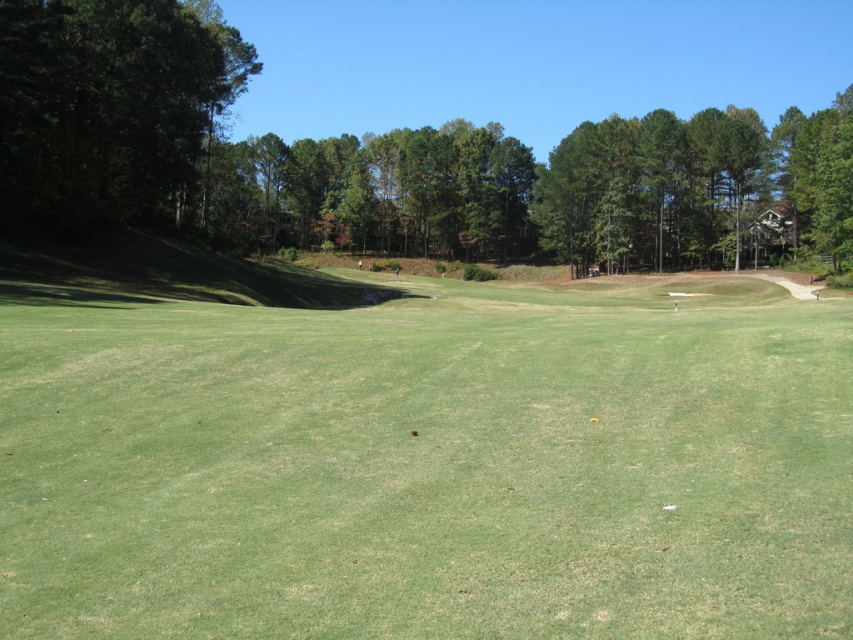
You are standing on the golf course and see the green leafy trees at upper center and the dark green leafy tree at left. Which tree is positioned more to the right side of the scene?

The green leafy trees at upper center are positioned to the right of the dark green leafy tree at left, so they are more to the right side of the scene.

You are a golfer standing on the green grassy field at center. You want to hit a ball to the green leafy trees at upper center. Considering the width of the areas, which area is narrower?

The green grassy field at center is narrower than the green leafy trees at upper center because its width is less than the trees.

You are a golfer standing on the green grassy field at center. You want to hit a ball to the dark green leafy tree at left. Considering the spatial relationship between them, which direction should you aim to ensure the ball reaches the tree?

The green grassy field at center is wider than the dark green leafy tree at left, so you should aim slightly to the left side of the tree to account for the field width difference.